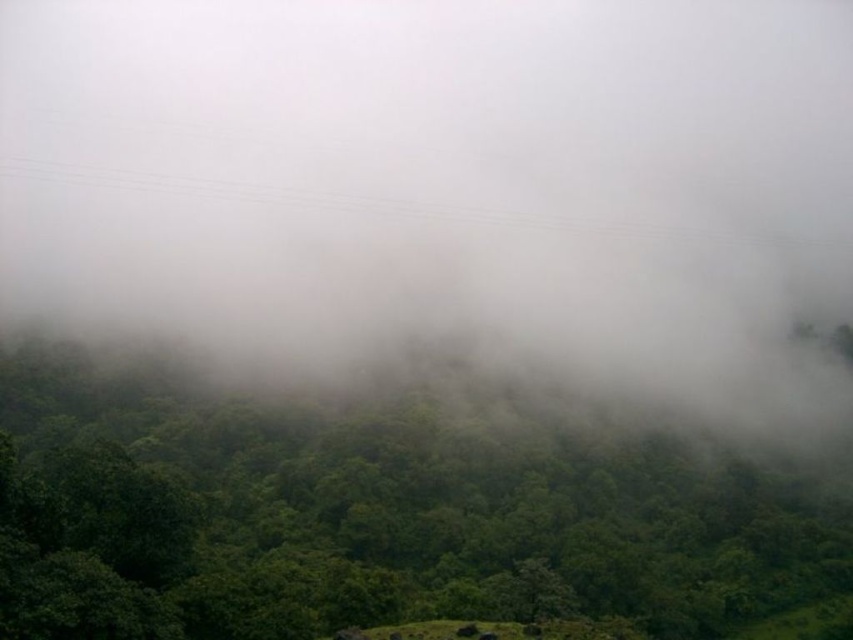
Question: Is white misty fog at center positioned behind green leafy tree at center?

Choices:
 (A) yes
 (B) no

Answer: (A)

Question: From the image, what is the correct spatial relationship of white misty fog at center in relation to green leafy tree at center?

Choices:
 (A) below
 (B) above

Answer: (B)

Question: Does white misty fog at center come in front of green leafy tree at center?

Choices:
 (A) no
 (B) yes

Answer: (A)

Question: Which of the following is the closest to the observer?

Choices:
 (A) (480, 509)
 (B) (370, 65)

Answer: (A)